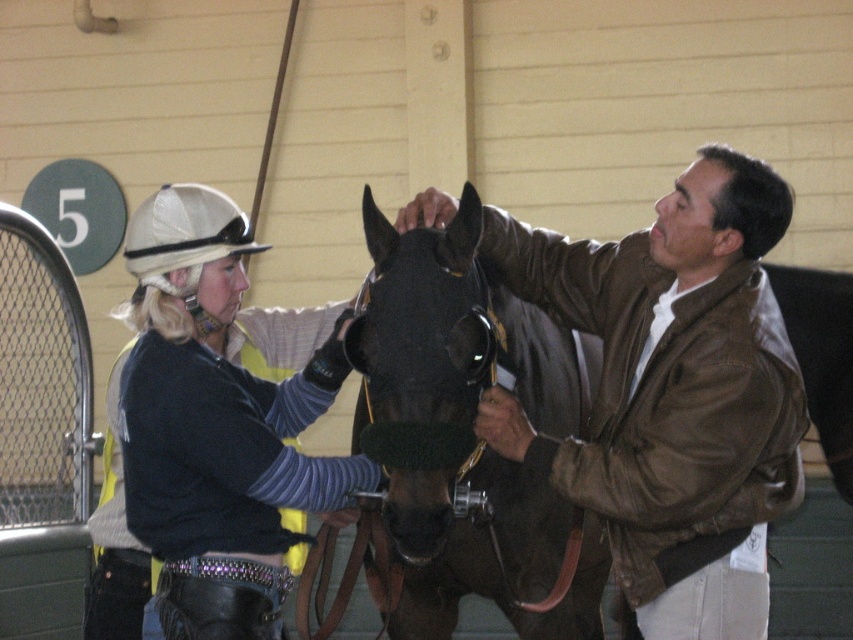
Can you confirm if brown leather jacket at center is thinner than shiny black horse at center?

No, brown leather jacket at center is not thinner than shiny black horse at center.

Can you confirm if brown leather jacket at center is positioned above shiny black horse at center?

Indeed, brown leather jacket at center is positioned over shiny black horse at center.

Where is `brown leather jacket at center`? The height and width of the screenshot is (640, 853). brown leather jacket at center is located at coordinates (672, 392).

At what (x,y) coordinates should I click in order to perform the action: click on brown leather jacket at center. Please return your answer as a coordinate pair (x, y). This screenshot has width=853, height=640. Looking at the image, I should click on (672, 392).

Does brown leather jacket at center have a lesser height compared to matte black helmet at upper left?

No, brown leather jacket at center is not shorter than matte black helmet at upper left.

Is brown leather jacket at center positioned in front of matte black helmet at upper left?

No, brown leather jacket at center is further to the viewer.

Where is `brown leather jacket at center`? brown leather jacket at center is located at coordinates (672, 392).

Is shiny black horse at center smaller than matte black helmet at upper left?

Actually, shiny black horse at center might be larger than matte black helmet at upper left.

Does shiny black horse at center have a greater width compared to matte black helmet at upper left?

Yes.

This screenshot has width=853, height=640. What are the coordinates of `shiny black horse at center` in the screenshot? It's located at (467, 435).